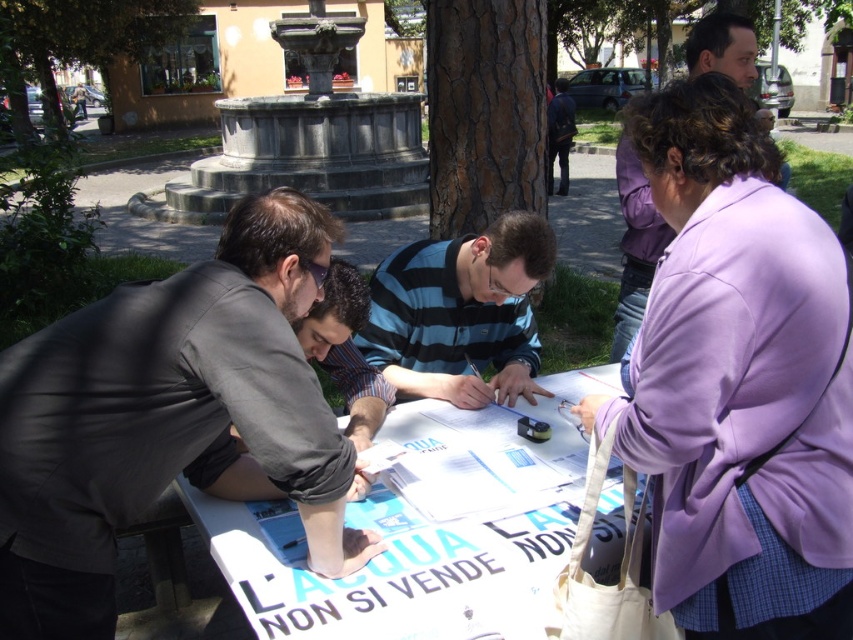
You are a photographer standing at the camera position. You want to capture a closeup of the white paper at center without moving the camera. Is it possible to do so with the current distance?

The white paper at center and the camera are 4.73 feet apart. Since the distance is fixed, you can adjust the camera lens or zoom to capture a closeup of the white paper at center without moving the camera.

Consider the image. You are standing at the center of the image and want to hand a document to the person wearing the dark gray suit at left. In which direction should you move to approach them?

Since the dark gray suit at left is located at point 0.653 on the x and 0.199 on the y, you should move to the left and slightly downward to reach them.

Consider the image. You are a photographer at the event and want to capture a photo that includes both the white paper at center and the purple fabric jacket at upper right. Based on their positions, which object should you place on the left side of your camera frame to ensure both are visible?

You should place the white paper at center on the left side of your camera frame since it is already to the left of the purple fabric jacket at upper right, ensuring both are visible in the frame.